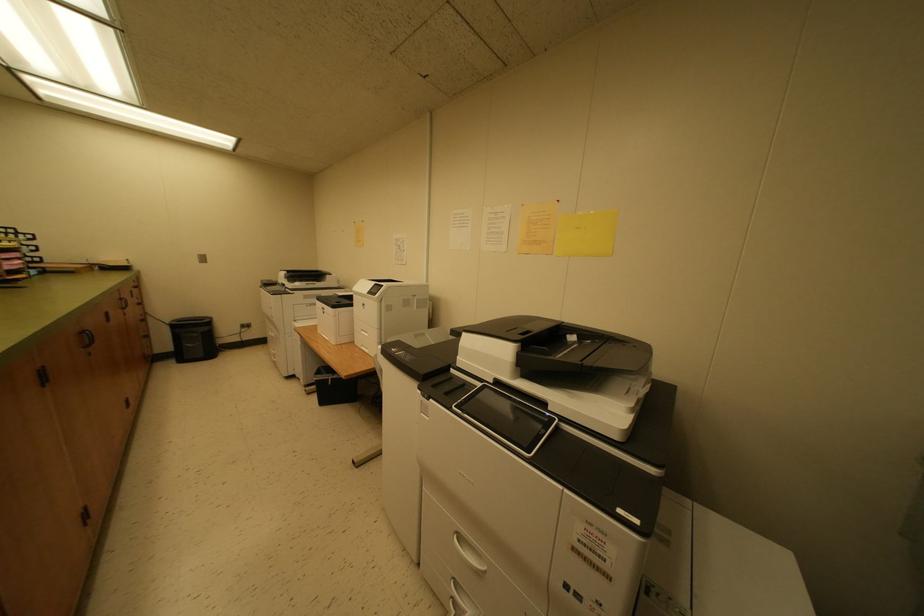
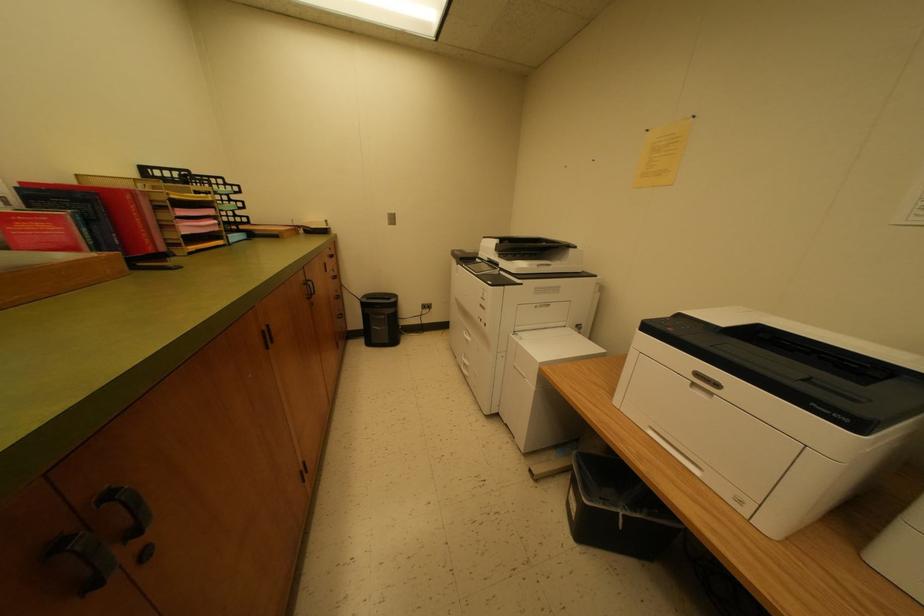
Which direction would the cameraman need to move to produce the second image?

The cameraman moved toward left, forward.